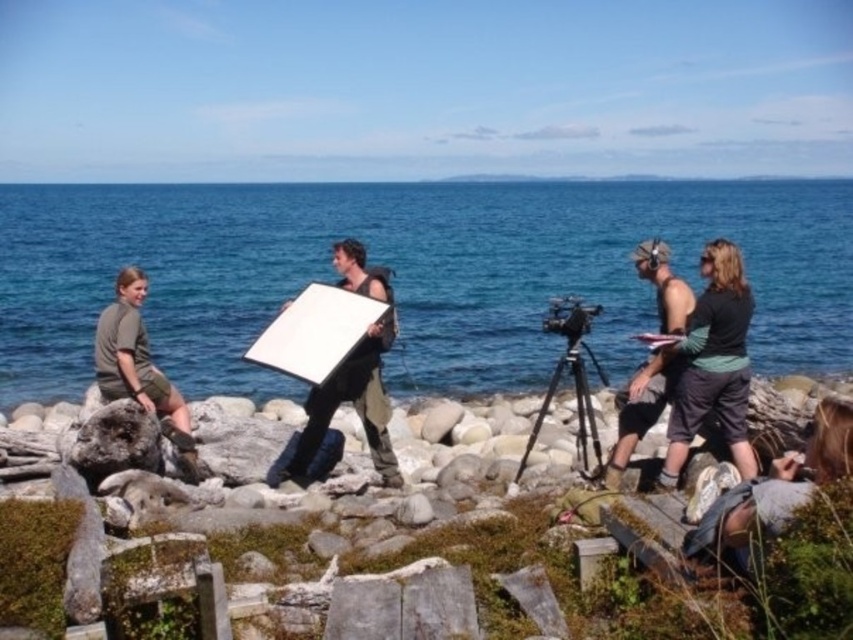
Is point (698, 424) in front of point (756, 490)?

No, (698, 424) is further to viewer.

Does green t-shirt at center have a lesser width compared to denim skirt at lower right?

Yes, green t-shirt at center is thinner than denim skirt at lower right.

Who is more forward, (711, 365) or (824, 472)?

Point (824, 472) is in front.

At what (x,y) coordinates should I click in order to perform the action: click on green t-shirt at center. Please return your answer as a coordinate pair (x, y). This screenshot has height=640, width=853. Looking at the image, I should click on (712, 364).

Which is in front, point (647, 273) or point (579, 403)?

Point (579, 403) is in front.

Is matte black shirt at right above black metal tripod at center?

Yes.

Where is `matte black shirt at right`? matte black shirt at right is located at coordinates click(x=640, y=408).

Image resolution: width=853 pixels, height=640 pixels. Find the location of `matte black shirt at right`. matte black shirt at right is located at coordinates (640, 408).

Between blue water at center and green t-shirt at center, which one appears on the right side from the viewer's perspective?

green t-shirt at center is more to the right.

Which of these two, blue water at center or green t-shirt at center, stands taller?

Standing taller between the two is blue water at center.

You are a GUI agent. You are given a task and a screenshot of the screen. Output one action in this format:
    pyautogui.click(x=<x>, y=<y>)
    Task: Click on the blue water at center
    The image size is (853, 640).
    Given the screenshot: What is the action you would take?
    pyautogui.click(x=408, y=273)